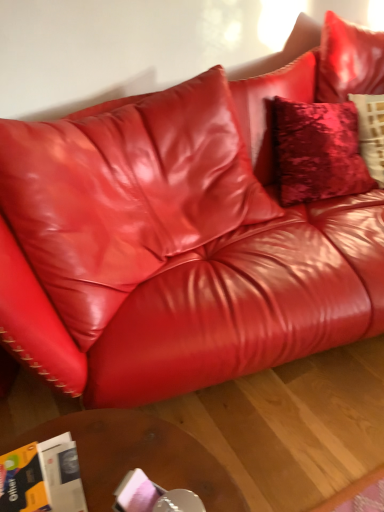
Question: From a real-world perspective, is orange glossy magazine at lower left positioned above or below brown wooden table at lower center?

Choices:
 (A) below
 (B) above

Answer: (B)

Question: Is orange glossy magazine at lower left to the left or to the right of brown wooden table at lower center in the image?

Choices:
 (A) left
 (B) right

Answer: (A)

Question: Is point (61, 436) closer or farther from the camera than point (168, 423)?

Choices:
 (A) closer
 (B) farther

Answer: (A)

Question: From their relative heights in the image, would you say brown wooden table at lower center is taller or shorter than orange glossy magazine at lower left?

Choices:
 (A) short
 (B) tall

Answer: (B)

Question: Relative to orange glossy magazine at lower left, is brown wooden table at lower center in front or behind?

Choices:
 (A) front
 (B) behind

Answer: (B)

Question: Looking at the image, does brown wooden table at lower center seem bigger or smaller compared to orange glossy magazine at lower left?

Choices:
 (A) small
 (B) big

Answer: (B)

Question: Looking at their shapes, would you say brown wooden table at lower center is wider or thinner than orange glossy magazine at lower left?

Choices:
 (A) thin
 (B) wide

Answer: (B)